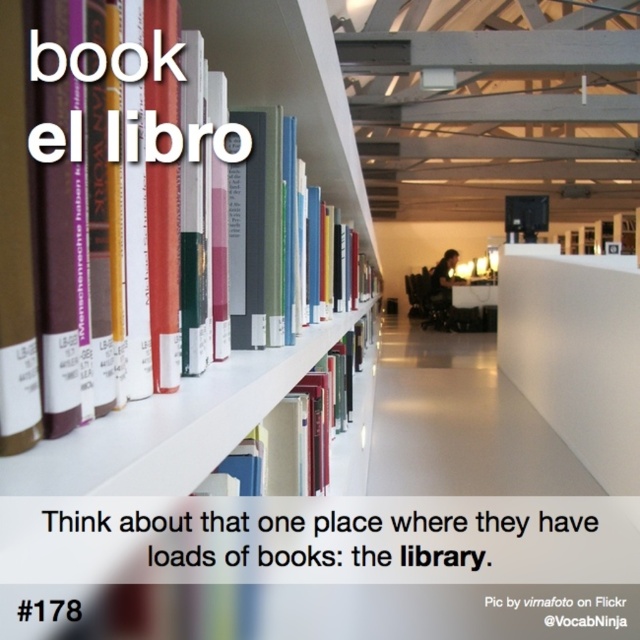
Question: Which of the following is the closest to the observer?

Choices:
 (A) hardcover books at left
 (B) hardcover book at center

Answer: (A)

Question: Is hardcover books at left positioned in front of dark brown hair at center?

Choices:
 (A) no
 (B) yes

Answer: (B)

Question: Which of the following is the closest to the observer?

Choices:
 (A) (368, 324)
 (B) (240, 12)
 (C) (442, 292)

Answer: (B)

Question: Observing the image, what is the correct spatial positioning of hardcover books at left in reference to dark brown hair at center?

Choices:
 (A) below
 (B) above

Answer: (B)

Question: Is hardcover book at center behind dark brown hair at center?

Choices:
 (A) yes
 (B) no

Answer: (B)

Question: Which point is closer to the camera?

Choices:
 (A) hardcover book at center
 (B) dark brown hair at center

Answer: (A)